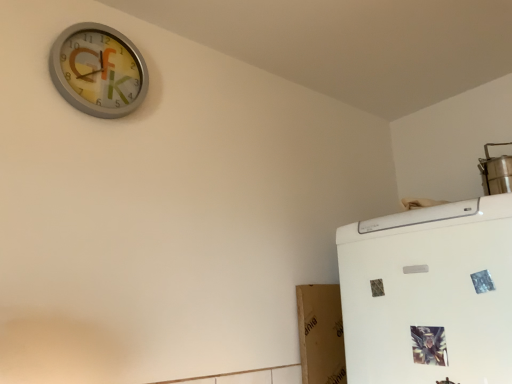
Question: Does stainless steel steamer at upper right lie in front of metallic silver clock at upper left?

Choices:
 (A) no
 (B) yes

Answer: (A)

Question: Is stainless steel steamer at upper right looking in the opposite direction of metallic silver clock at upper left?

Choices:
 (A) no
 (B) yes

Answer: (A)

Question: Could you tell me if stainless steel steamer at upper right is facing metallic silver clock at upper left?

Choices:
 (A) no
 (B) yes

Answer: (A)

Question: Is stainless steel steamer at upper right touching metallic silver clock at upper left?

Choices:
 (A) no
 (B) yes

Answer: (A)

Question: Does stainless steel steamer at upper right have a greater height compared to metallic silver clock at upper left?

Choices:
 (A) yes
 (B) no

Answer: (B)

Question: Is stainless steel steamer at upper right wider than metallic silver clock at upper left?

Choices:
 (A) yes
 (B) no

Answer: (A)

Question: Does metallic silver clock at upper left have a larger size compared to stainless steel steamer at upper right?

Choices:
 (A) yes
 (B) no

Answer: (B)

Question: Is metallic silver clock at upper left behind stainless steel steamer at upper right?

Choices:
 (A) yes
 (B) no

Answer: (B)

Question: Can you confirm if metallic silver clock at upper left is wider than stainless steel steamer at upper right?

Choices:
 (A) no
 (B) yes

Answer: (A)

Question: Is metallic silver clock at upper left aimed at stainless steel steamer at upper right?

Choices:
 (A) yes
 (B) no

Answer: (B)

Question: Is metallic silver clock at upper left looking in the opposite direction of stainless steel steamer at upper right?

Choices:
 (A) yes
 (B) no

Answer: (B)

Question: Can you confirm if metallic silver clock at upper left is smaller than stainless steel steamer at upper right?

Choices:
 (A) no
 (B) yes

Answer: (B)

Question: From their relative heights in the image, would you say metallic silver clock at upper left is taller or shorter than stainless steel steamer at upper right?

Choices:
 (A) tall
 (B) short

Answer: (A)